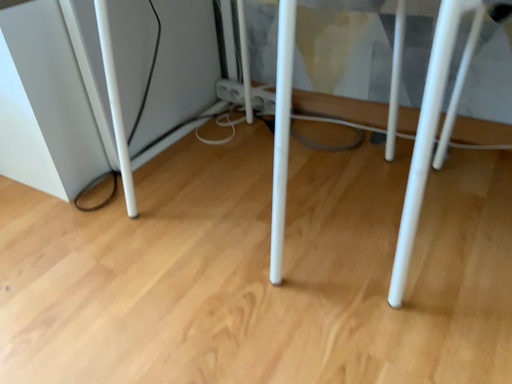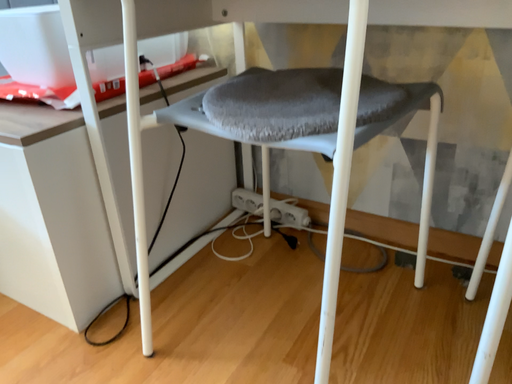
Question: Which way did the camera rotate in the video?

Choices:
 (A) rotated upward
 (B) rotated downward

Answer: (A)